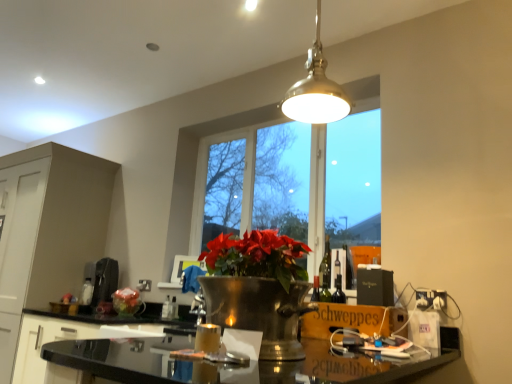
Question: Does wooden schweppes box at lower right lie in front of translucent glass bottle at center, which ranks as the 1th bottle in left-to-right order?

Choices:
 (A) no
 (B) yes

Answer: (B)

Question: Considering the relative positions of wooden schweppes box at lower right and translucent glass bottle at center, positioned as the 2th bottle in right-to-left order, in the image provided, is wooden schweppes box at lower right to the left of translucent glass bottle at center, positioned as the 2th bottle in right-to-left order, from the viewer's perspective?

Choices:
 (A) no
 (B) yes

Answer: (A)

Question: Is wooden schweppes box at lower right thinner than translucent glass bottle at center, positioned as the 2th bottle in right-to-left order?

Choices:
 (A) yes
 (B) no

Answer: (B)

Question: Can you confirm if wooden schweppes box at lower right is taller than translucent glass bottle at center, which ranks as the 1th bottle in left-to-right order?

Choices:
 (A) no
 (B) yes

Answer: (B)

Question: From the image's perspective, is wooden schweppes box at lower right below translucent glass bottle at center, positioned as the 2th bottle in right-to-left order?

Choices:
 (A) yes
 (B) no

Answer: (B)

Question: Can you confirm if wooden schweppes box at lower right is positioned to the right of translucent glass bottle at center, positioned as the 2th bottle in right-to-left order?

Choices:
 (A) yes
 (B) no

Answer: (A)

Question: Considering the relative positions of matte white cabinet at left, marked as the first cabinetry in a left-to-right arrangement, and black matte coffee machine at left in the image provided, is matte white cabinet at left, marked as the first cabinetry in a left-to-right arrangement, behind black matte coffee machine at left?

Choices:
 (A) yes
 (B) no

Answer: (B)

Question: From a real-world perspective, is matte white cabinet at left, marked as the first cabinetry in a left-to-right arrangement, physically below black matte coffee machine at left?

Choices:
 (A) yes
 (B) no

Answer: (B)

Question: From the image's perspective, does matte white cabinet at left, positioned as the 2th cabinetry in right-to-left order, appear lower than black matte coffee machine at left?

Choices:
 (A) no
 (B) yes

Answer: (B)

Question: Is matte white cabinet at left, positioned as the 2th cabinetry in right-to-left order, next to black matte coffee machine at left?

Choices:
 (A) no
 (B) yes

Answer: (A)

Question: Can you confirm if matte white cabinet at left, positioned as the 2th cabinetry in right-to-left order, is shorter than black matte coffee machine at left?

Choices:
 (A) yes
 (B) no

Answer: (B)

Question: Is matte white cabinet at left, positioned as the 2th cabinetry in right-to-left order, looking in the opposite direction of black matte coffee machine at left?

Choices:
 (A) no
 (B) yes

Answer: (A)

Question: Are clear glass window at center and translucent glass bottle at center, which ranks as the 1th bottle in left-to-right order, beside each other?

Choices:
 (A) yes
 (B) no

Answer: (B)